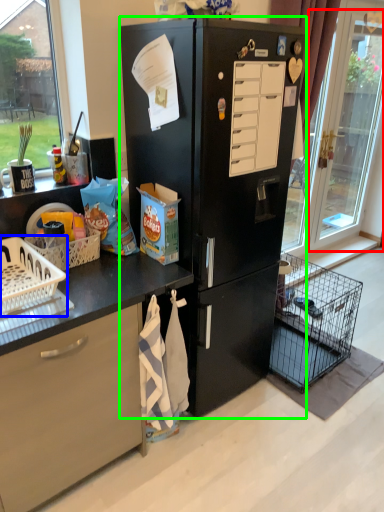
Question: Based on their relative distances, which object is farther from glass door (highlighted by a red box)? Choose from basket (highlighted by a blue box) and refrigerator (highlighted by a green box).

Choices:
 (A) basket
 (B) refrigerator

Answer: (A)